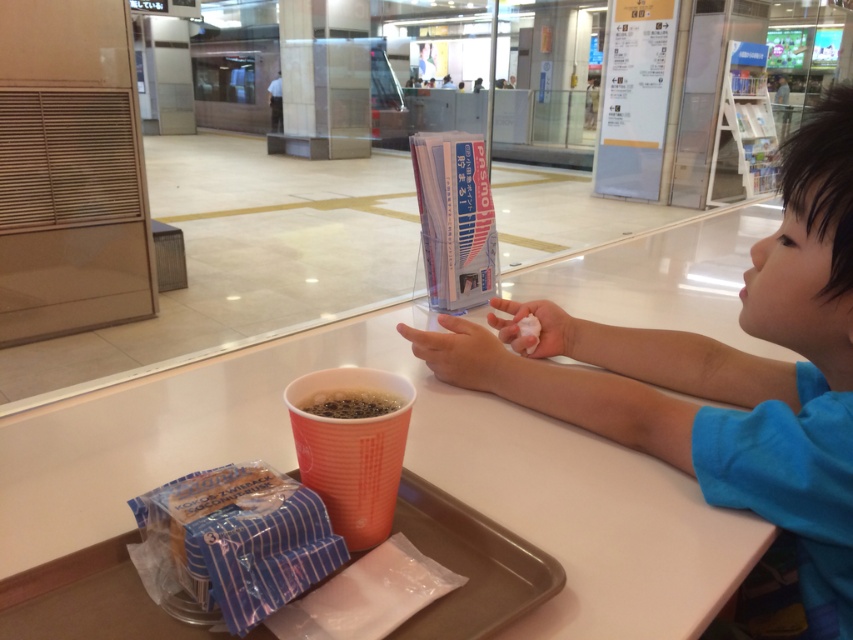
Question: Which object is the farthest from the blue cotton shirt at right?

Choices:
 (A) smooth skin hand at center
 (B) orange paper cup at lower center
 (C) plastic tray at center
 (D) white matte tissue at center

Answer: (B)

Question: Can you confirm if blue cotton shirt at right is positioned to the left of smooth skin hand at center?

Choices:
 (A) yes
 (B) no

Answer: (B)

Question: Is plastic tray at center further to the viewer compared to smooth skin hand at center?

Choices:
 (A) no
 (B) yes

Answer: (A)

Question: Which of the following is the farthest from the observer?

Choices:
 (A) (381, 387)
 (B) (799, 330)

Answer: (B)

Question: Among these points, which one is nearest to the camera?

Choices:
 (A) (770, 358)
 (B) (339, 413)
 (C) (328, 490)
 (D) (492, 365)

Answer: (C)

Question: Is plastic tray at center wider than white matte tissue at center?

Choices:
 (A) no
 (B) yes

Answer: (B)